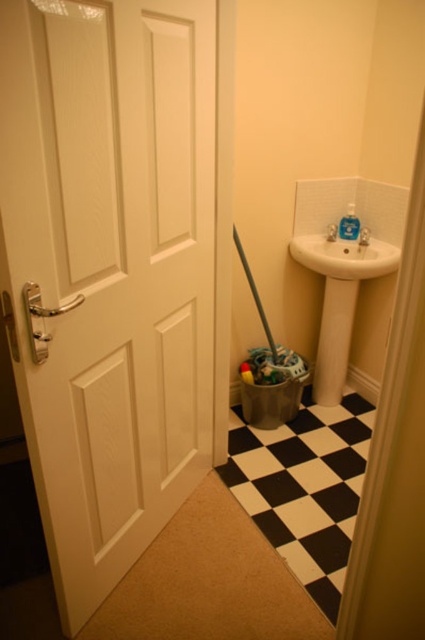
Based on the photo, which is below, white matte door at left or metallic silver brush at center?

white matte door at left is below.

Where is `white matte door at left`? white matte door at left is located at coordinates [x=108, y=269].

Consider the image. Between white matte door at left and white glossy sink at upper right, which one appears on the right side from the viewer's perspective?

From the viewer's perspective, white glossy sink at upper right appears more on the right side.

Can you confirm if white matte door at left is positioned below white glossy sink at upper right?

Yes, white matte door at left is below white glossy sink at upper right.

The image size is (425, 640). I want to click on white matte door at left, so click(108, 269).

Where is `white matte door at left`? The width and height of the screenshot is (425, 640). white matte door at left is located at coordinates (108, 269).

Consider the image. Which of these two, white glossy sink at upper right or metallic silver brush at center, stands taller?

metallic silver brush at center is taller.

Is white glossy sink at upper right wider than metallic silver brush at center?

Yes.

Which is in front, point (362, 266) or point (257, 298)?

Point (362, 266)

In order to click on white glossy sink at upper right in this screenshot , I will do `click(345, 257)`.